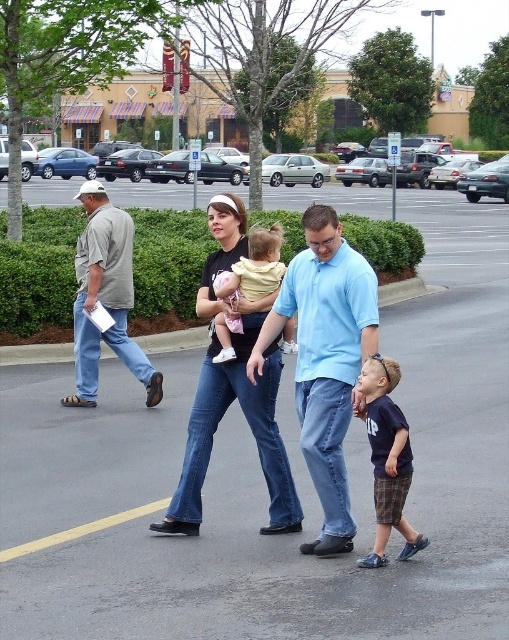
You are a photographer trying to capture a photo of the family. You notice the black cotton shirt at center and the yellow cotton shirt at center. Which one is more to the left in the image?

The black cotton shirt at center is positioned on the left side of the yellow cotton shirt at center, so the black cotton shirt at center is more to the left.

Based on the scene description, which clothing item is taller between the black cotton shirt at center and the yellow cotton shirt at center?

The black cotton shirt at center is much taller than the yellow cotton shirt at center.